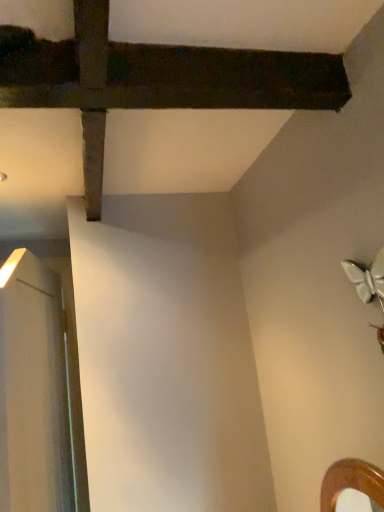
Image resolution: width=384 pixels, height=512 pixels. What do you see at coordinates (33, 390) in the screenshot?
I see `white glossy door at left` at bounding box center [33, 390].

Image resolution: width=384 pixels, height=512 pixels. I want to click on white glossy door at left, so click(x=33, y=390).

Measure the distance between point (6, 373) and camera.

Point (6, 373) is 3.62 feet away from camera.

Identify the location of white glossy door at left. The width and height of the screenshot is (384, 512). (33, 390).